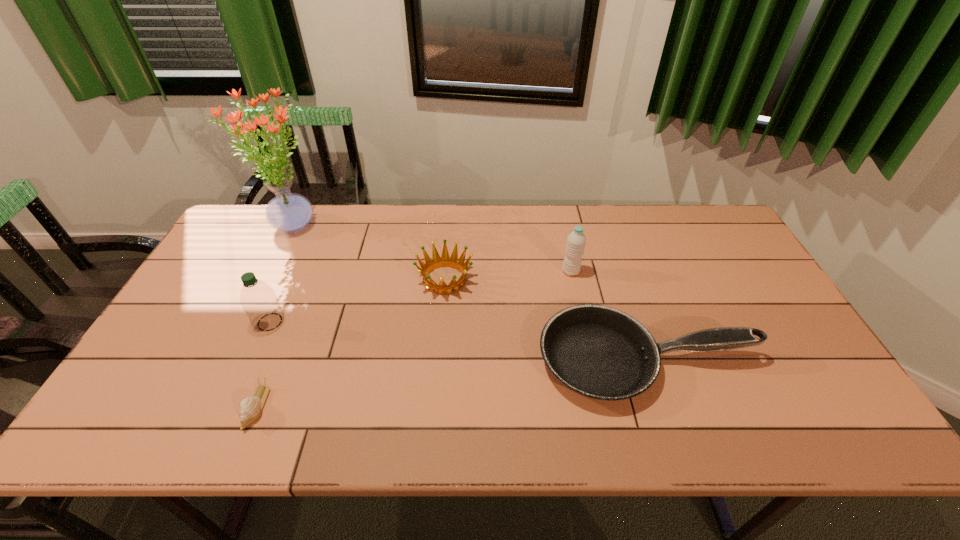
I want to click on vacant space at the near edge of the desktop, so click(180, 430).

Locate an element on the screen. This screenshot has width=960, height=540. free space at the left edge is located at coordinates (251, 261).

In the image, there is a desktop. Identify the location of vacant space at the far right corner. (690, 227).

The width and height of the screenshot is (960, 540). I want to click on free spot between the farther water bottle and the shortest object, so click(x=414, y=339).

I want to click on free space between the escargot and the third object from right to left, so click(x=350, y=343).

This screenshot has width=960, height=540. I want to click on empty space between the escargot and the third object from right to left, so click(350, 343).

Find the location of a particular element. free space between the frying pan and the nearer water bottle is located at coordinates (459, 341).

At what (x,y) coordinates should I click in order to perform the action: click on vacant point located between the flower arrangement and the crown. Please return your answer as a coordinate pair (x, y). This screenshot has width=960, height=540. Looking at the image, I should click on click(369, 253).

This screenshot has width=960, height=540. I want to click on vacant space that is in between the left water bottle and the third object from right to left, so click(x=357, y=301).

Locate an element on the screen. The width and height of the screenshot is (960, 540). free point between the farthest object and the third object from right to left is located at coordinates (369, 253).